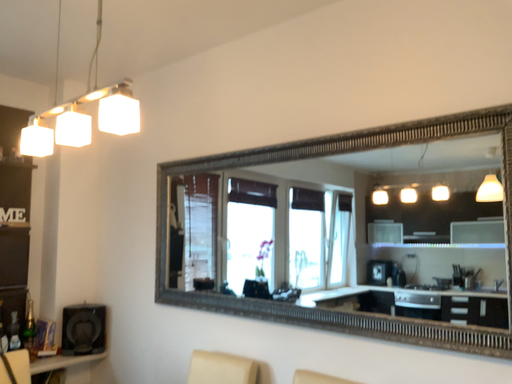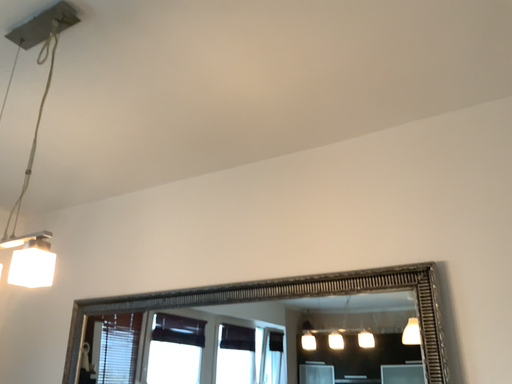
Question: Which way did the camera rotate in the video?

Choices:
 (A) rotated upward
 (B) rotated downward

Answer: (A)